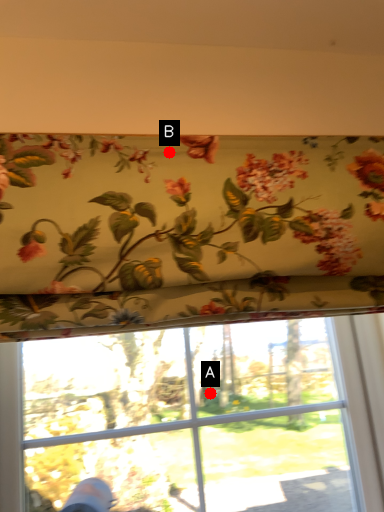
Question: Two points are circled on the image, labeled by A and B beside each circle. Which of the following is the farthest from the observer?

Choices:
 (A) A is further
 (B) B is further

Answer: (A)